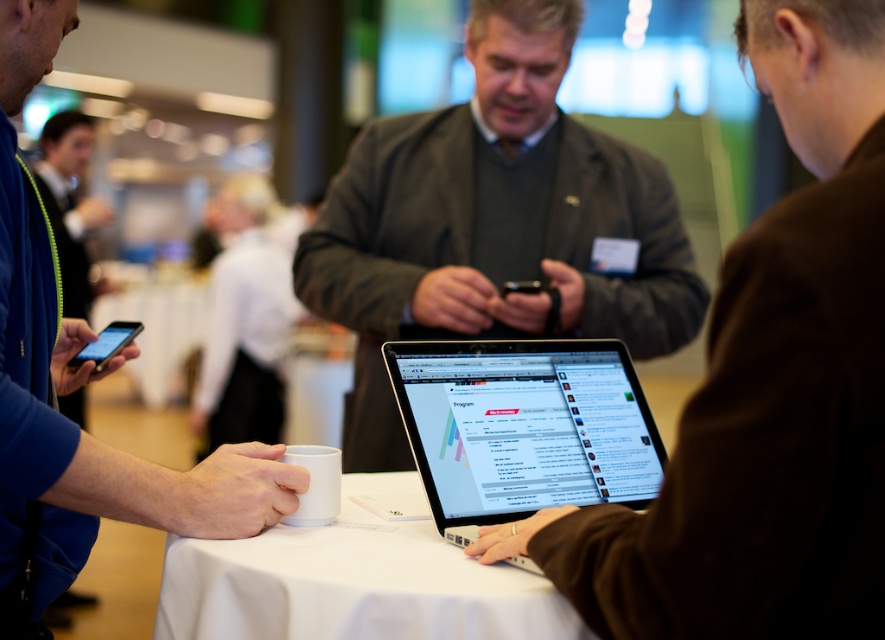
You are organizing a virtual meeting and need to position the camera to focus on the satin black laptop at center. According to the scene description, where should you place the camera to ensure the laptop is centered in the frame?

The camera should be positioned to focus on the coordinates point at (x=522, y=428) where the satin black laptop at center is located.